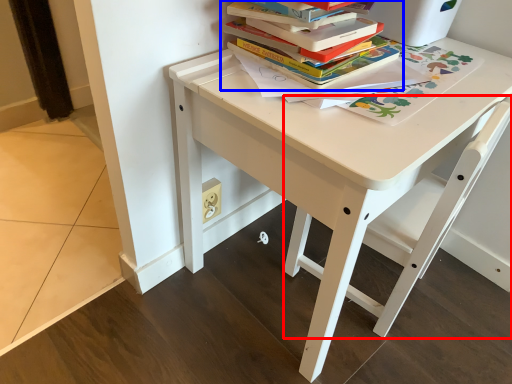
Question: Which point is closer to the camera, chair (highlighted by a red box) or book (highlighted by a blue box)?

Choices:
 (A) chair
 (B) book

Answer: (A)